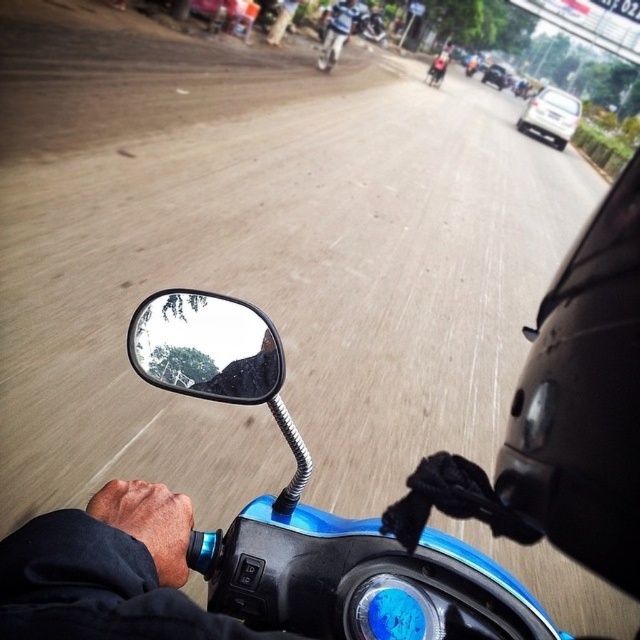
You are riding a motorcycle and want to know the distance between you and the point at coordinates point (596, 547). Can you determine the distance?

The distance between you and the point (596, 547) is 4.80 feet.

You are riding a motorcycle and need to check your helmet position. Where is the black matte helmet at right located in terms of coordinates?

The black matte helmet at right is located at coordinates point (x=584, y=400).